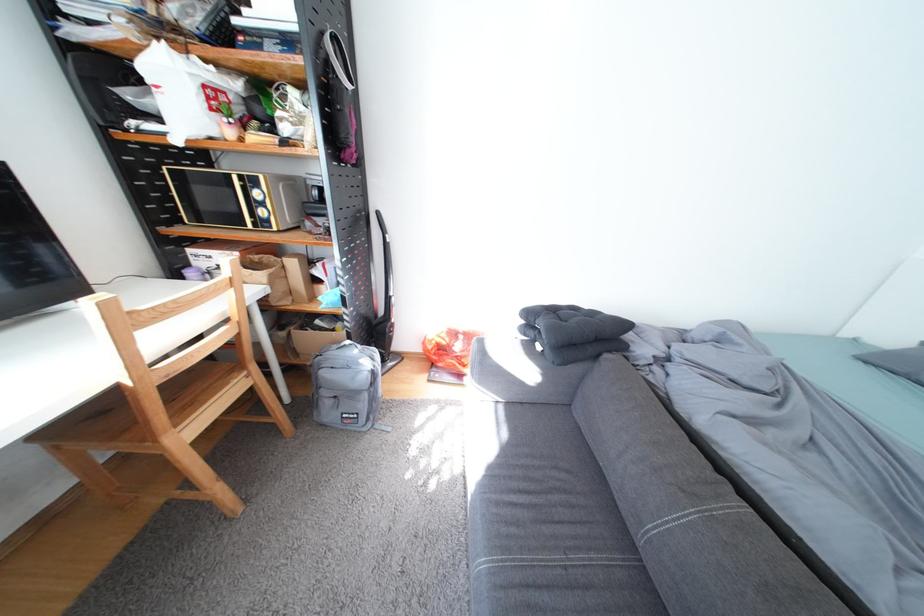
Where would you grasp the stick vacuum handle? Please return your answer as a coordinate pair (x, y).

(385, 305)